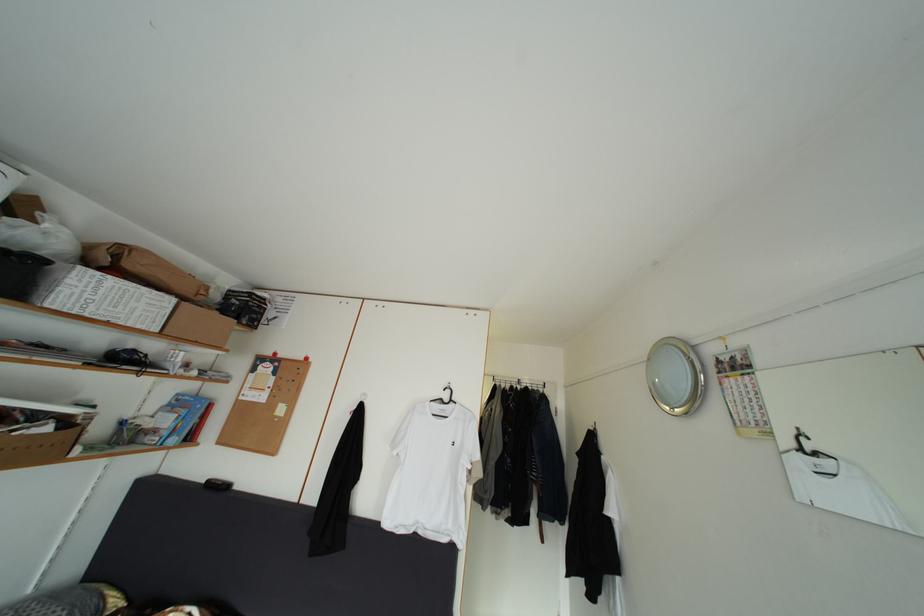
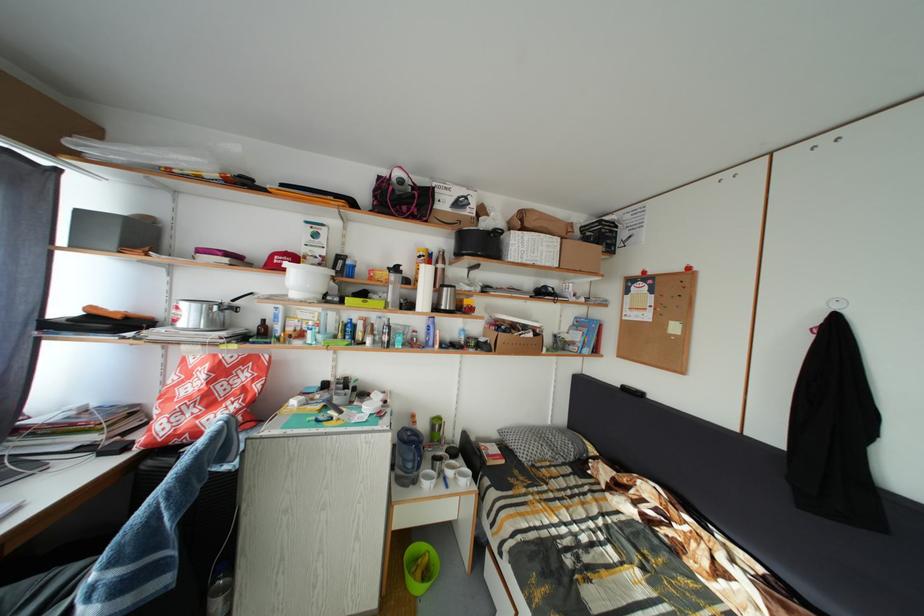
The point at (55,435) is marked in the first image. Where is the corresponding point in the second image?

(540, 341)